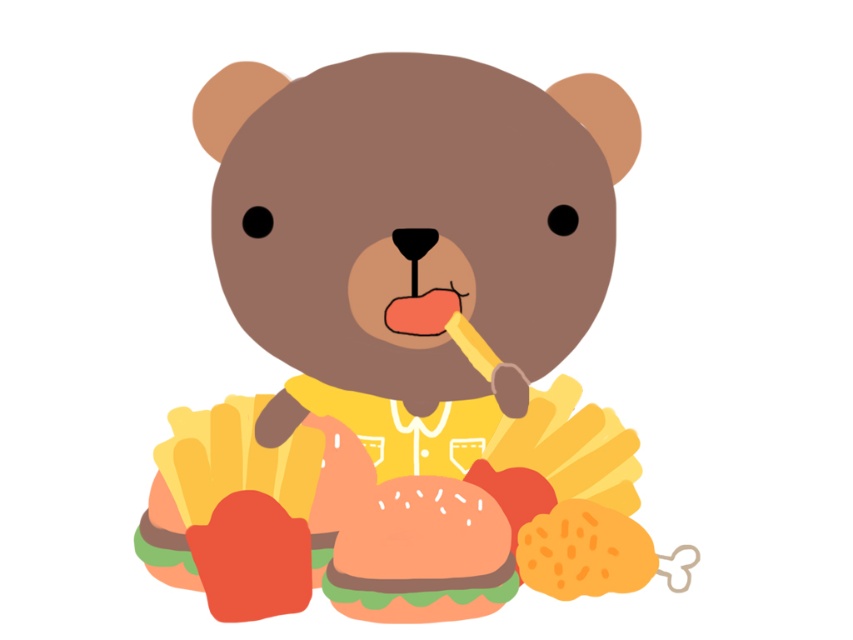
You are a food delivery robot with a 4 inch wide tray. You need to place a burger on the tray. The burger is the smooth orange hamburger at center. The matte yellow bear at center is in the way. Can you move the burger to the tray without moving the bear?

The distance between the matte yellow bear at center and the smooth orange hamburger at center is 5.22 inches. Since the robot tray is 4 inches wide, there is enough space between them to move the burger to the tray without touching the bear.

Based on the scene description, which object is bigger between the matte yellow bear at center and the smooth orange hamburger at center?

The matte yellow bear at center is larger than the smooth orange hamburger at center.

In the cartoon scene, there is a matte yellow bear at center and a smooth orange hamburger at center. From the bear to the hamburger, which direction should you look?

The matte yellow bear at center is to the left of the smooth orange hamburger at center, so you should look to the right to see the smooth orange hamburger at center from the bear.